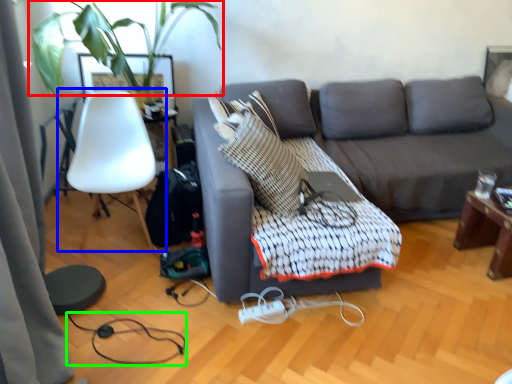
Question: Considering the real-world distances, which object is farthest from plant (highlighted by a red box)? chair (highlighted by a blue box) or cable (highlighted by a green box)?

Choices:
 (A) chair
 (B) cable

Answer: (B)